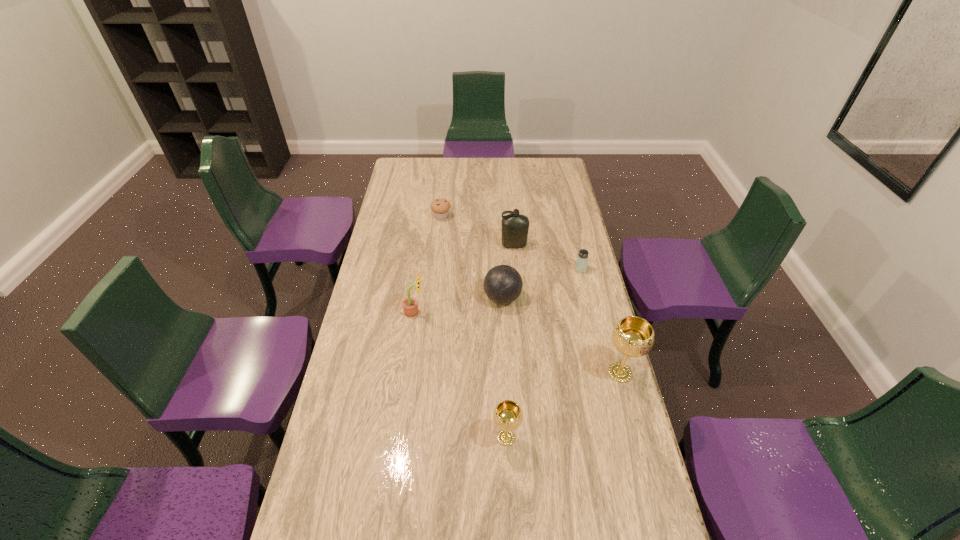
Considering the uniform spacing of chalices, where should an additional chalice be positioned on the left? Please locate a free spot. Please provide its 2D coordinates. Your answer should be formatted as a tuple, i.e. [(x, y)], where the tuple contains the x and y coordinates of a point satisfying the conditions above.

[(360, 521)]